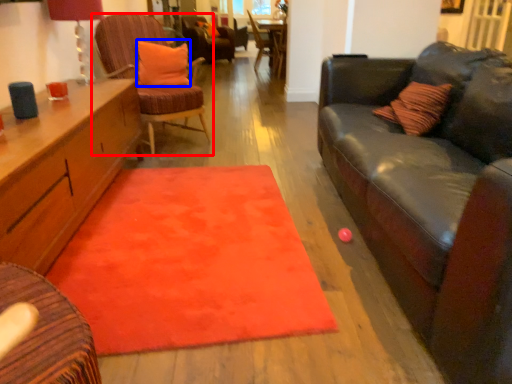
Question: Among these objects, which one is nearest to the camera, chair (highlighted by a red box) or pillow (highlighted by a blue box)?

Choices:
 (A) chair
 (B) pillow

Answer: (A)